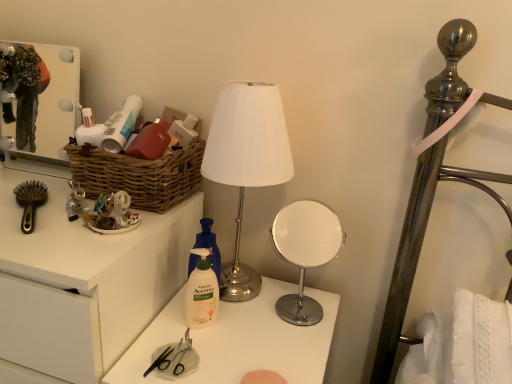
Question: Considering the relative positions of brown plastic brush at left and white glossy medicine cabinet at upper left in the image provided, is brown plastic brush at left behind white glossy medicine cabinet at upper left?

Choices:
 (A) yes
 (B) no

Answer: (B)

Question: Is brown plastic brush at left smaller than white glossy medicine cabinet at upper left?

Choices:
 (A) yes
 (B) no

Answer: (A)

Question: Is brown plastic brush at left bigger than white glossy medicine cabinet at upper left?

Choices:
 (A) yes
 (B) no

Answer: (B)

Question: Is white glossy medicine cabinet at upper left located within brown plastic brush at left?

Choices:
 (A) no
 (B) yes

Answer: (A)

Question: From the image's perspective, is brown plastic brush at left located above white glossy medicine cabinet at upper left?

Choices:
 (A) no
 (B) yes

Answer: (A)

Question: Considering the positions of point (211, 127) and point (178, 369), is point (211, 127) closer or farther from the camera than point (178, 369)?

Choices:
 (A) farther
 (B) closer

Answer: (A)

Question: Is white matte lamp at center bigger or smaller than metallic silver scissors at center?

Choices:
 (A) big
 (B) small

Answer: (A)

Question: Considering their positions, is white matte lamp at center located in front of or behind metallic silver scissors at center?

Choices:
 (A) front
 (B) behind

Answer: (A)

Question: From their relative heights in the image, would you say white matte lamp at center is taller or shorter than metallic silver scissors at center?

Choices:
 (A) tall
 (B) short

Answer: (A)

Question: In terms of height, does brown plastic brush at left look taller or shorter compared to white glossy mirror at center right?

Choices:
 (A) tall
 (B) short

Answer: (B)

Question: From a real-world perspective, is brown plastic brush at left above or below white glossy mirror at center right?

Choices:
 (A) above
 (B) below

Answer: (A)

Question: In terms of size, does brown plastic brush at left appear bigger or smaller than white glossy mirror at center right?

Choices:
 (A) small
 (B) big

Answer: (A)

Question: Choose the correct answer: Is brown plastic brush at left inside white glossy mirror at center right or outside it?

Choices:
 (A) inside
 (B) outside

Answer: (B)

Question: Visually, is white glossy drawer at left positioned to the left or to the right of brown plastic brush at left?

Choices:
 (A) right
 (B) left

Answer: (B)

Question: From the image's perspective, relative to brown plastic brush at left, is white glossy drawer at left above or below?

Choices:
 (A) above
 (B) below

Answer: (B)